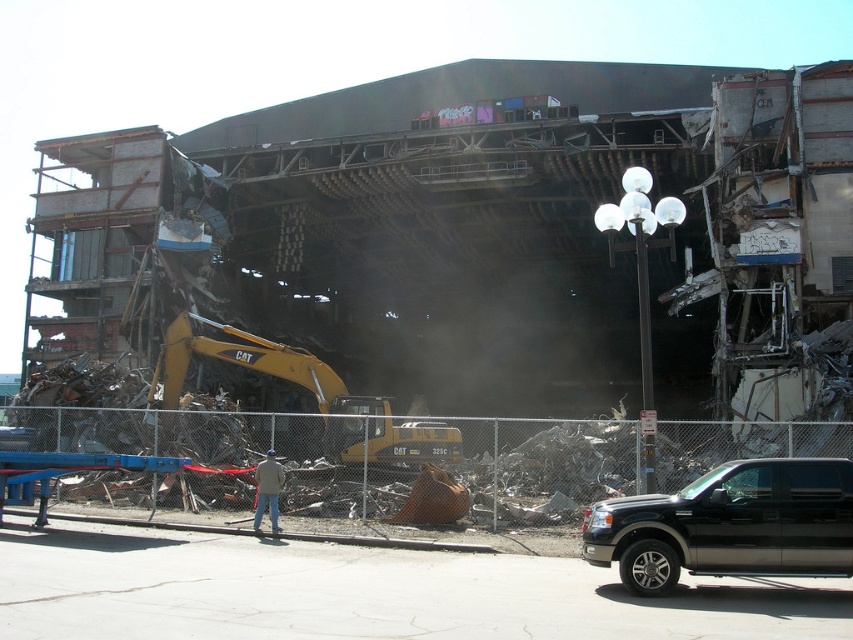
Who is lower down, black matte suv at lower right or khaki fabric jacket at center?

khaki fabric jacket at center is lower down.

Can you confirm if black matte suv at lower right is thinner than khaki fabric jacket at center?

Incorrect, black matte suv at lower right's width is not less than khaki fabric jacket at center's.

Is point (735, 470) closer to viewer compared to point (271, 508)?

Yes.

Find the location of a particular element. This screenshot has height=640, width=853. black matte suv at lower right is located at coordinates (729, 524).

Is yellow metallic excavator at left positioned behind khaki fabric jacket at center?

Yes, yellow metallic excavator at left is further from the viewer.

Between point (416, 451) and point (274, 506), which one is positioned behind?

The point (416, 451) is behind.

The height and width of the screenshot is (640, 853). In order to click on yellow metallic excavator at left in this screenshot , I will do `click(312, 394)`.

Is black matte suv at lower right wider than yellow metallic excavator at left?

No.

Between black matte suv at lower right and yellow metallic excavator at left, which one has more height?

yellow metallic excavator at left

Which is in front, point (758, 525) or point (389, 444)?

Positioned in front is point (758, 525).

Image resolution: width=853 pixels, height=640 pixels. I want to click on black matte suv at lower right, so click(x=729, y=524).